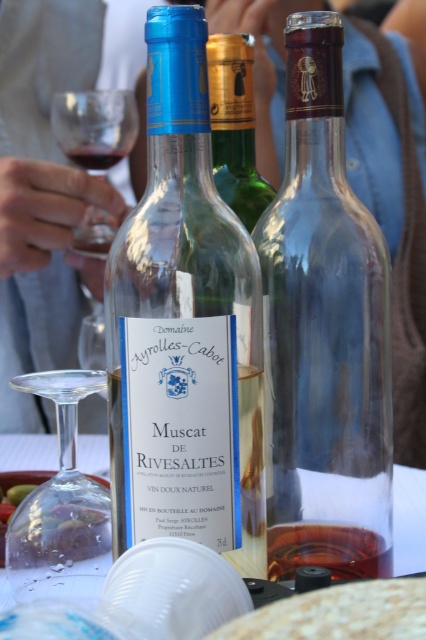
Question: Can you confirm if white glass bottle at center is positioned above transparent glass at upper left?

Choices:
 (A) yes
 (B) no

Answer: (B)

Question: Which object is the farthest from the white plastic cup at center?

Choices:
 (A) green glass bottle at center
 (B) transparent glass bottle at center
 (C) white glass bottle at center
 (D) transparent glass at upper left

Answer: (D)

Question: Is the position of transparent glass at lower left more distant than that of dark red liquid at bottle left?

Choices:
 (A) yes
 (B) no

Answer: (B)

Question: Which object is the closest to the transparent glass at lower left?

Choices:
 (A) white plastic cup at center
 (B) amber liquid at bottle right
 (C) white glass bottle at center
 (D) transparent glass bottle at center

Answer: (C)

Question: Where is green glass bottle at center located in relation to amber liquid at bottle right in the image?

Choices:
 (A) below
 (B) above

Answer: (B)

Question: Based on their relative distances, which object is nearer to the amber liquid at bottle right?

Choices:
 (A) white plastic cup at center
 (B) white glass bottle at center
 (C) transparent glass at upper left
 (D) green glass bottle at center

Answer: (B)